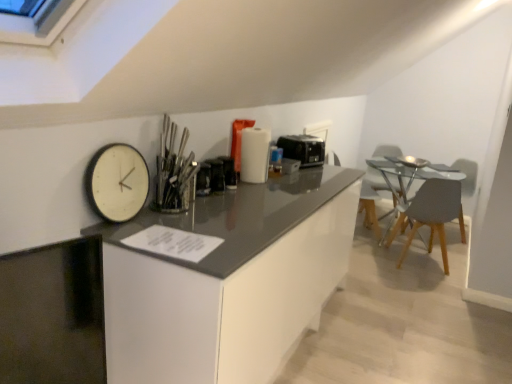
At what (x,y) coordinates should I click in order to perform the action: click on free space in front of white matte clock at left. Please return your answer as a coordinate pair (x, y). The width and height of the screenshot is (512, 384). Looking at the image, I should click on tap(124, 237).